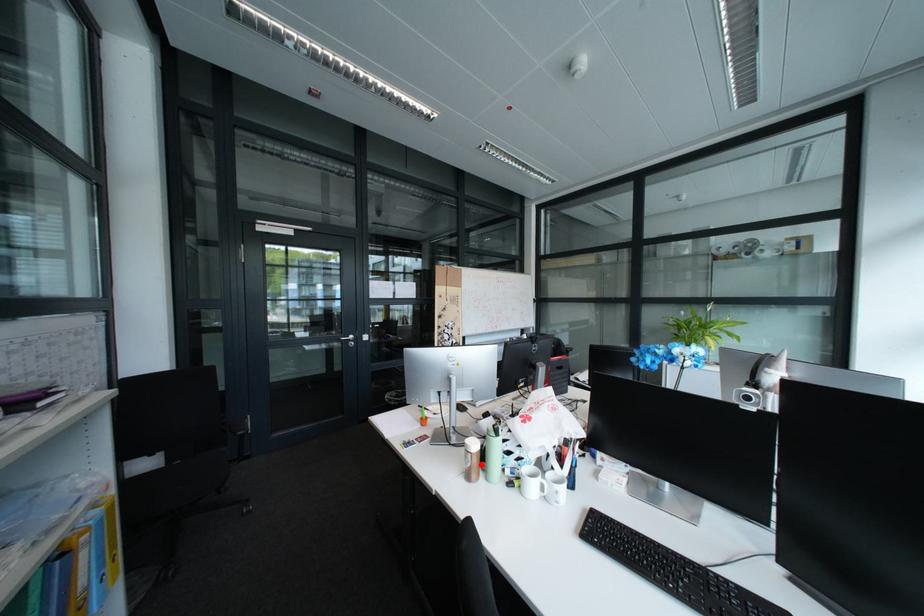
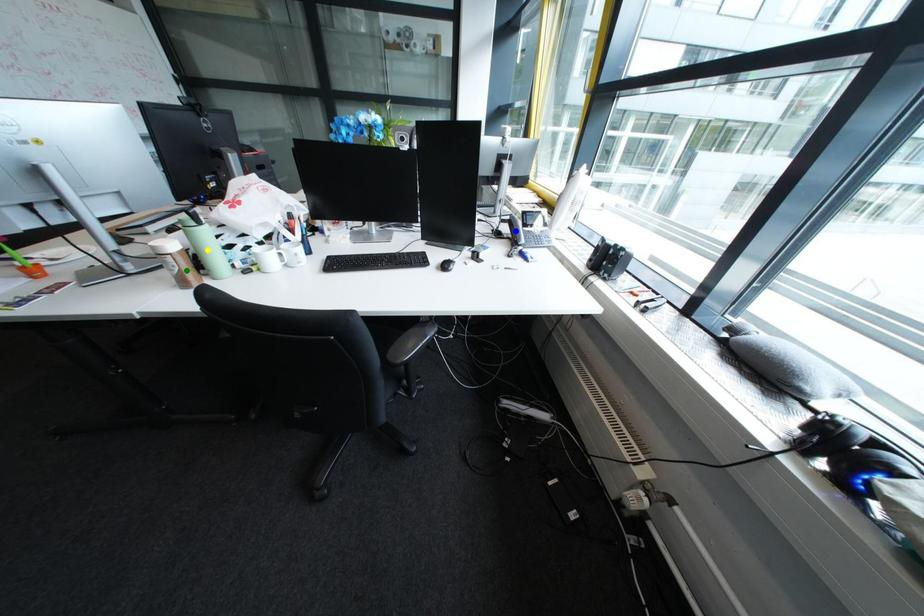
Question: I am providing you with two images of the same scene from different viewpoints. A red point is marked on the first image. You are given multiple points on the second image. In image 2, which mark is for the same physical point as the one in image 1?

Choices:
 (A) green point
 (B) blue point
 (C) yellow point

Answer: (A)